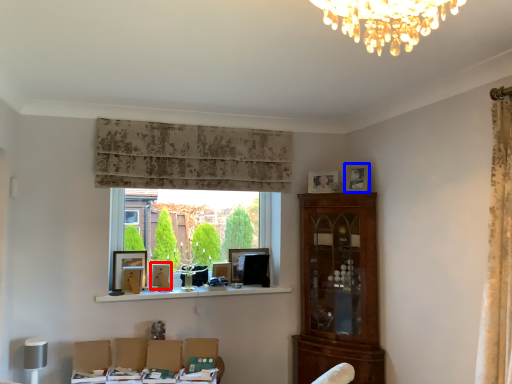
Question: Which object appears closest to the camera in this image, picture frame (highlighted by a red box) or picture frame (highlighted by a blue box)?

Choices:
 (A) picture frame
 (B) picture frame

Answer: (B)